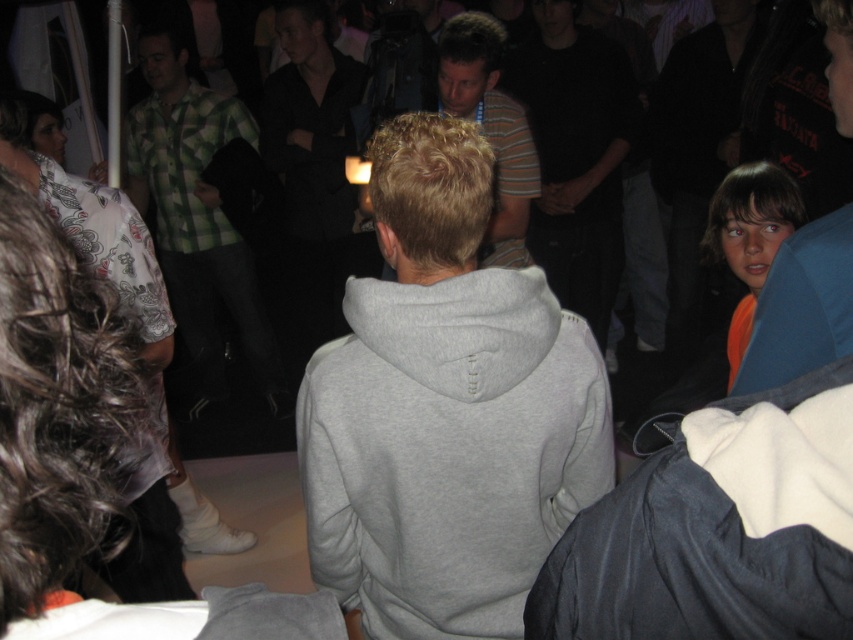
You are at an event and want to find the person wearing the orange fabric at right. Which direction should you look from the dark gray hoodie at center to locate them?

The orange fabric at right is to the right side of the dark gray hoodie at center, so you should look to the right from the dark gray hoodie at center to locate them.

Looking at this image, you are standing in the room and want to move from point A to point B. Point A is at coordinate point[463,52] and point B is at coordinate point[790,208]. Which point is closer to you?

Point A at coordinate point[463,52] is closer to you than point B at coordinate point[790,208].